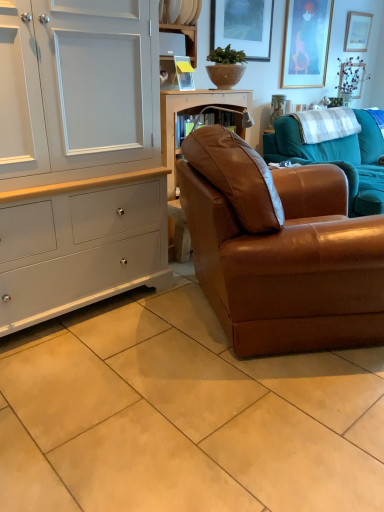
In order to click on vacant space that's between brown leather couch at right, acting as the first studio couch starting from the front, and white painted wood cabinet at left in this screenshot , I will do `click(135, 342)`.